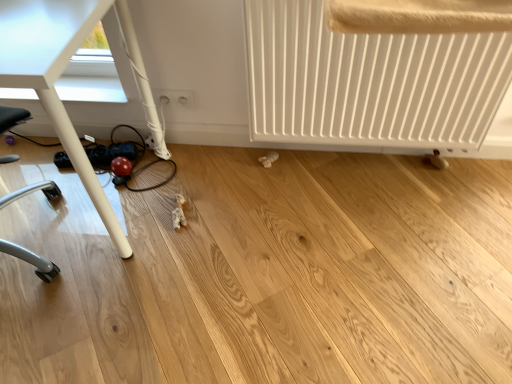
I want to click on empty space that is in between white glossy table at lower left and white matte radiator at lower right, so click(x=266, y=198).